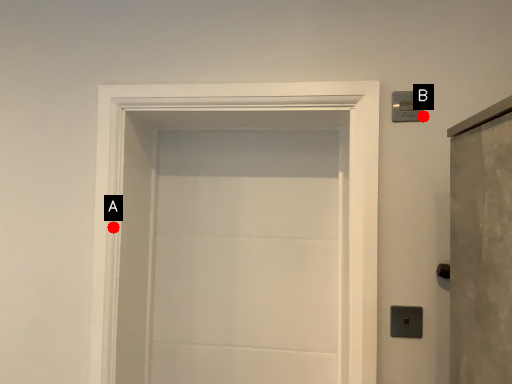
Question: Two points are circled on the image, labeled by A and B beside each circle. Which point appears closest to the camera in this image?

Choices:
 (A) A is closer
 (B) B is closer

Answer: (B)